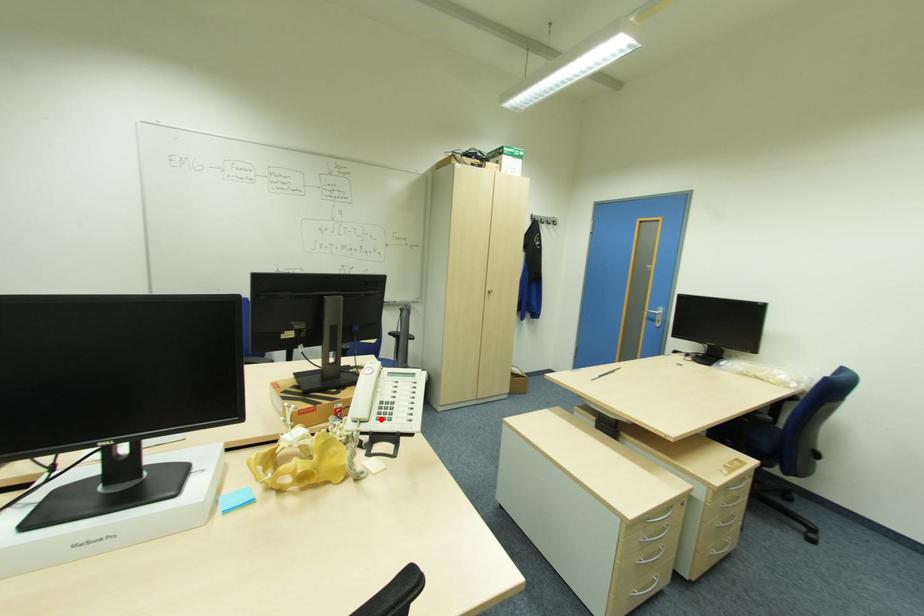
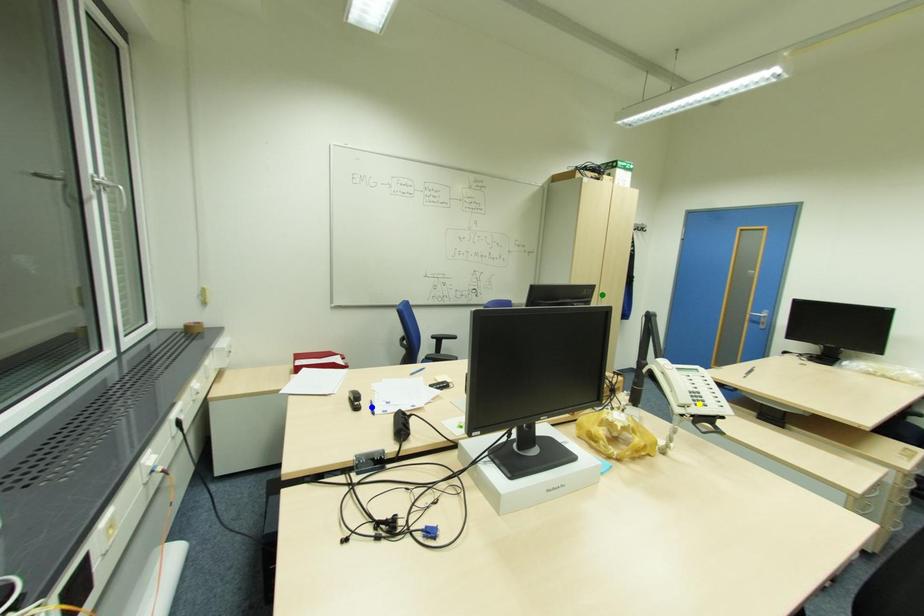
Question: I am providing you with two images of the same scene from different viewpoints. A red point is marked on the first image. You are given multiple points on the second image. Which point in image 2 represents the same 3d spot as the red point in image 1?

Choices:
 (A) green point
 (B) blue point
 (C) yellow point

Answer: (C)